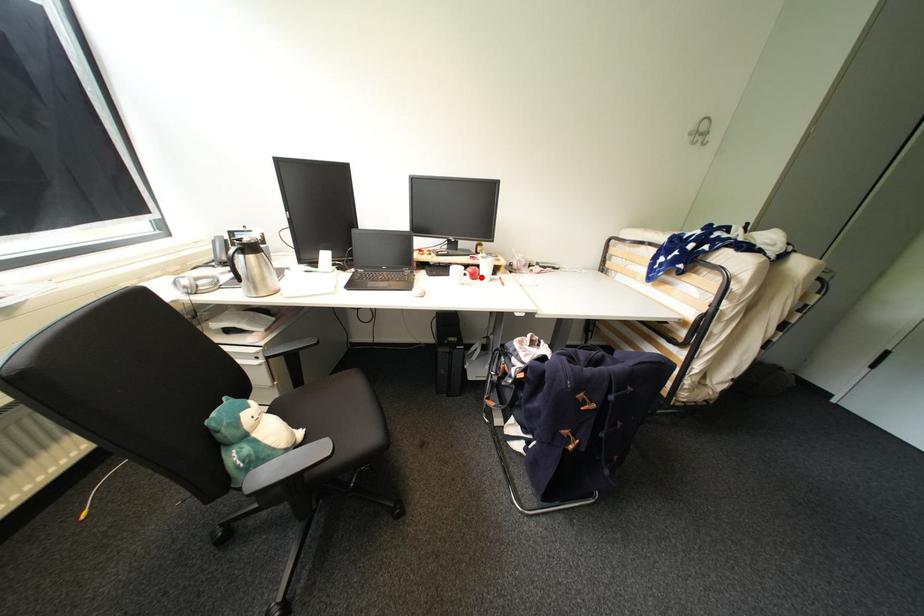
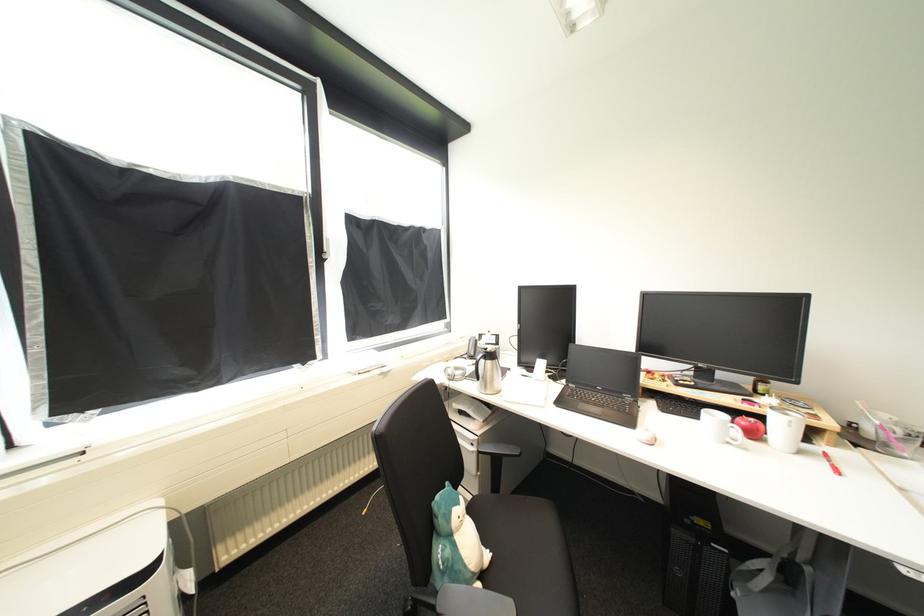
Locate, in the second image, the point that corresponds to the highlighted location in the first image.

(761, 436)